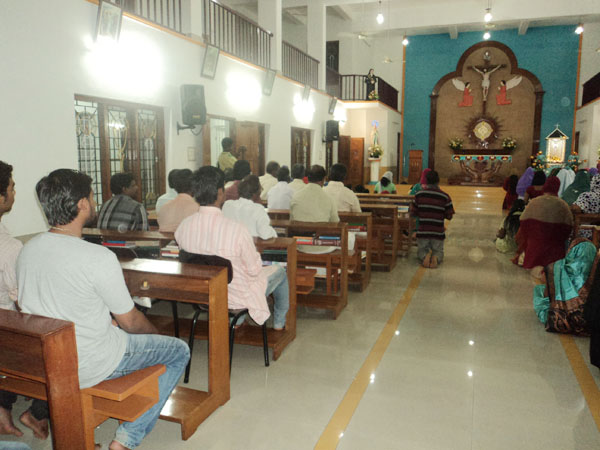
Find the location of a particular element. The image size is (600, 450). lights is located at coordinates (137, 59), (243, 91), (302, 104), (343, 112), (381, 21), (406, 39), (491, 15), (485, 36), (578, 32).